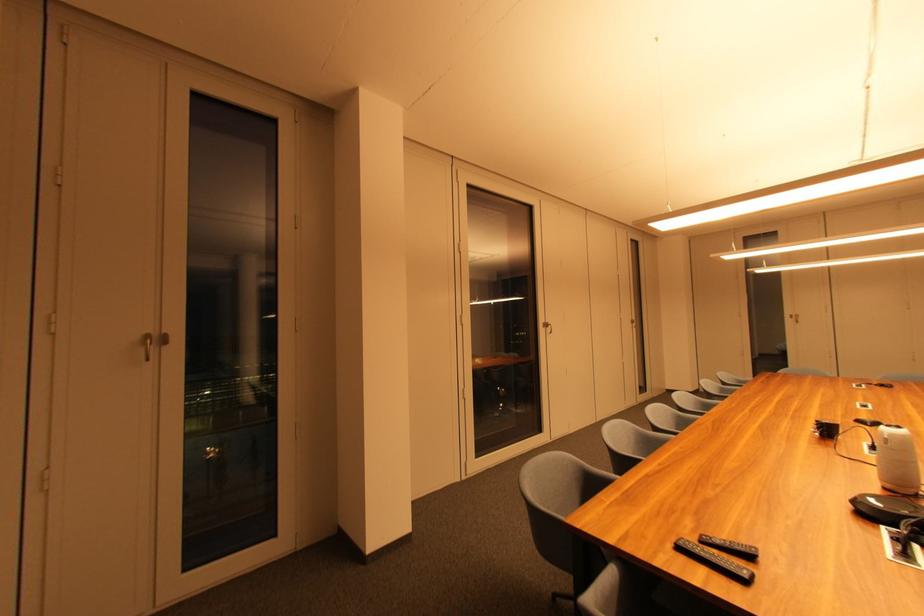
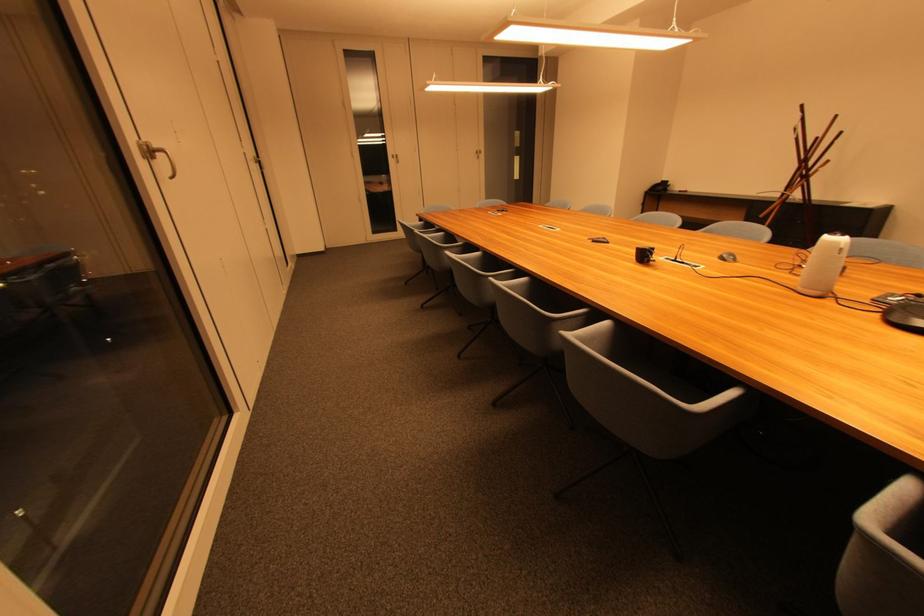
In the second image, find the point that corresponds to (x=636, y=323) in the first image.

(259, 163)